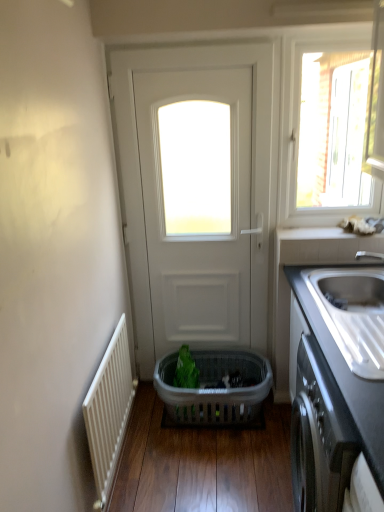
Where is `free space above white matte door at center (from a real-world perspective)`? free space above white matte door at center (from a real-world perspective) is located at coordinates (196, 48).